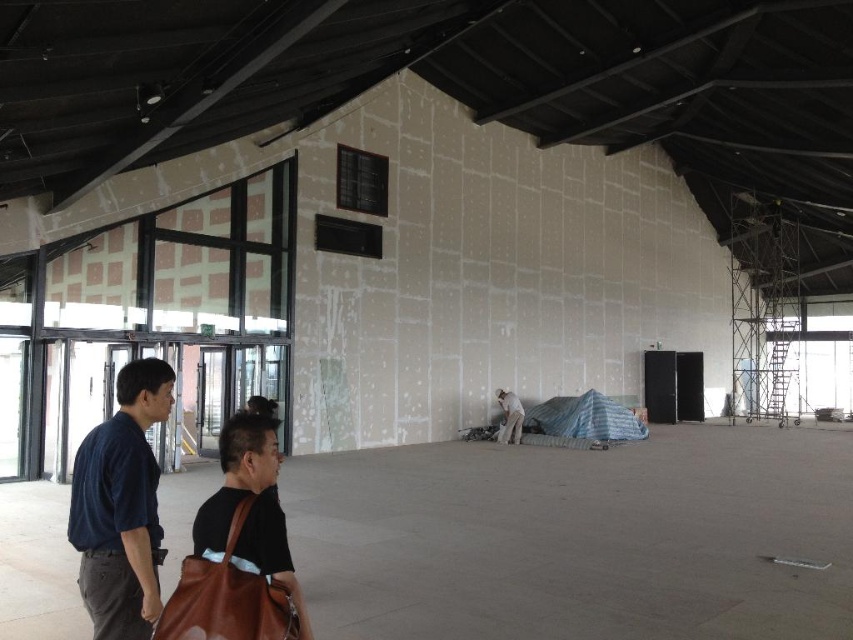
Does dark blue shirt at left appear over brown leather bag at lower center?

Yes, dark blue shirt at left is above brown leather bag at lower center.

Measure the distance from dark blue shirt at left to brown leather bag at lower center.

dark blue shirt at left is 56.44 centimeters from brown leather bag at lower center.

Between point (67, 531) and point (262, 616), which one is positioned in front?

Point (262, 616)

This screenshot has width=853, height=640. What are the coordinates of `dark blue shirt at left` in the screenshot? It's located at (120, 506).

Does brown leather bag at lower center have a greater width compared to white matte man at center?

No.

Between point (231, 577) and point (498, 388), which one is positioned behind?

Point (498, 388)

Where is `brown leather bag at lower center`? brown leather bag at lower center is located at coordinates (225, 598).

Is brown leather bag at lower left in front of brown leather bag at lower center?

That is False.

Can you confirm if brown leather bag at lower left is smaller than brown leather bag at lower center?

No, brown leather bag at lower left is not smaller than brown leather bag at lower center.

Is point (248, 557) more distant than point (252, 595)?

Yes.

At what (x,y) coordinates should I click in order to perform the action: click on brown leather bag at lower left. Please return your answer as a coordinate pair (x, y). Looking at the image, I should click on (250, 508).